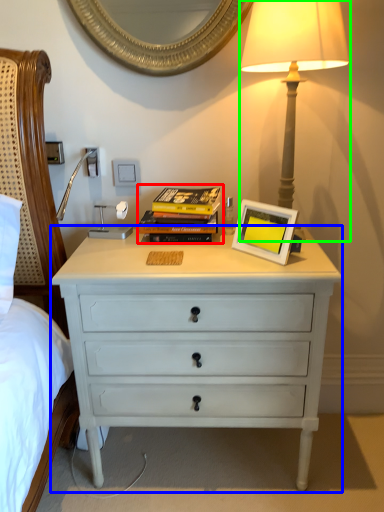
Question: Which object is the farthest from magazine (highlighted by a red box)? Choose among these: chest of drawers (highlighted by a blue box) or bedside lamp (highlighted by a green box).

Choices:
 (A) chest of drawers
 (B) bedside lamp

Answer: (B)